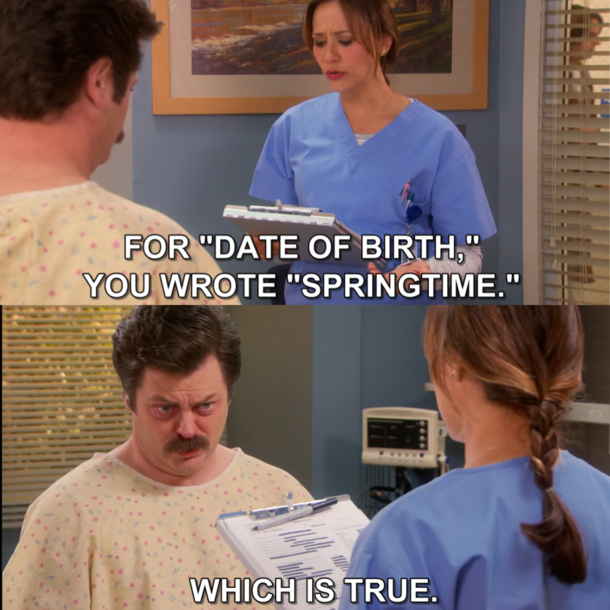
Identify the location of framed wall print. This screenshot has height=610, width=610. (260, 55).